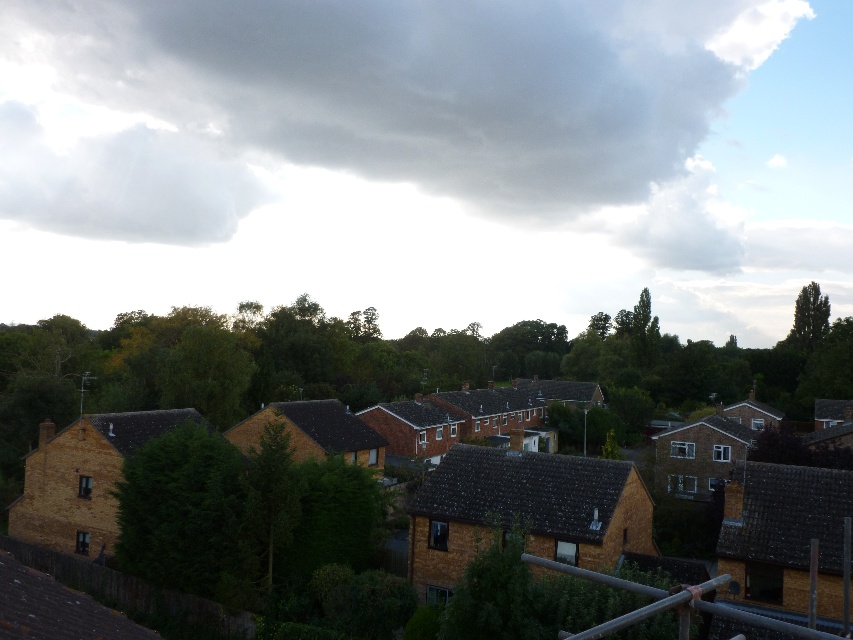
In the scene shown: Who is lower down, gray fluffy cloud at upper center or green leafy tree at upper right?

green leafy tree at upper right

Which is behind, point (424, 32) or point (825, 326)?

Point (424, 32)

The image size is (853, 640). Find the location of `gray fluffy cloud at upper center`. gray fluffy cloud at upper center is located at coordinates (370, 108).

Between point (200, 204) and point (825, 304), which one is positioned in front?

Point (825, 304)

Can you confirm if white fluffy cloud at upper left is wider than green leafy tree at upper right?

Indeed, white fluffy cloud at upper left has a greater width compared to green leafy tree at upper right.

Who is more forward, [32,180] or [810,291]?

Positioned in front is point [810,291].

I want to click on white fluffy cloud at upper left, so click(x=119, y=173).

Looking at this image, which is more to the left, gray fluffy cloud at upper center or white fluffy cloud at upper left?

white fluffy cloud at upper left

Between point (589, 99) and point (67, 144), which one is positioned in front?

Positioned in front is point (589, 99).

At what (x,y) coordinates should I click in order to perform the action: click on gray fluffy cloud at upper center. Please return your answer as a coordinate pair (x, y). This screenshot has height=640, width=853. Looking at the image, I should click on (370, 108).